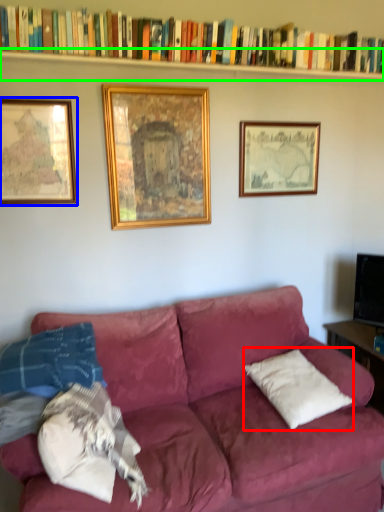
Question: Which object is the closest to the pillow (highlighted by a red box)? Choose among these: picture frame (highlighted by a blue box) or shelf (highlighted by a green box).

Choices:
 (A) picture frame
 (B) shelf

Answer: (A)